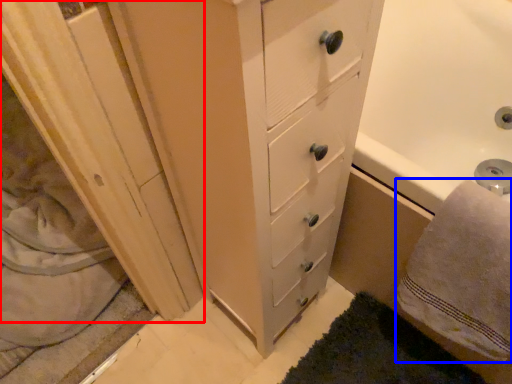
Question: Which of the following is the closest to the observer, screen door (highlighted by a red box) or bath towel (highlighted by a blue box)?

Choices:
 (A) screen door
 (B) bath towel

Answer: (B)